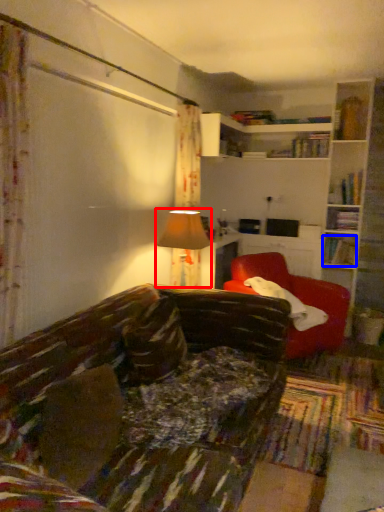
Question: Which object appears closest to the camera in this image, table lamp (highlighted by a red box) or book (highlighted by a blue box)?

Choices:
 (A) table lamp
 (B) book

Answer: (A)